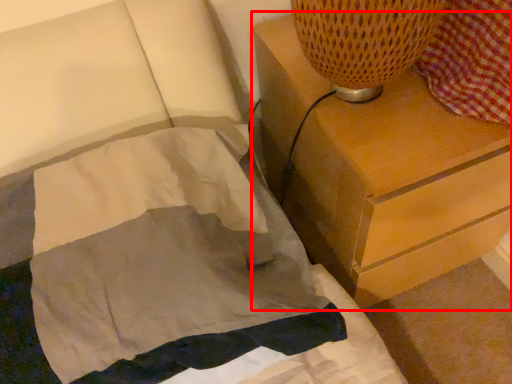
Question: Observing the image, what is the correct spatial positioning of chest of drawers (annotated by the red box) in reference to blanket?

Choices:
 (A) right
 (B) left

Answer: (A)